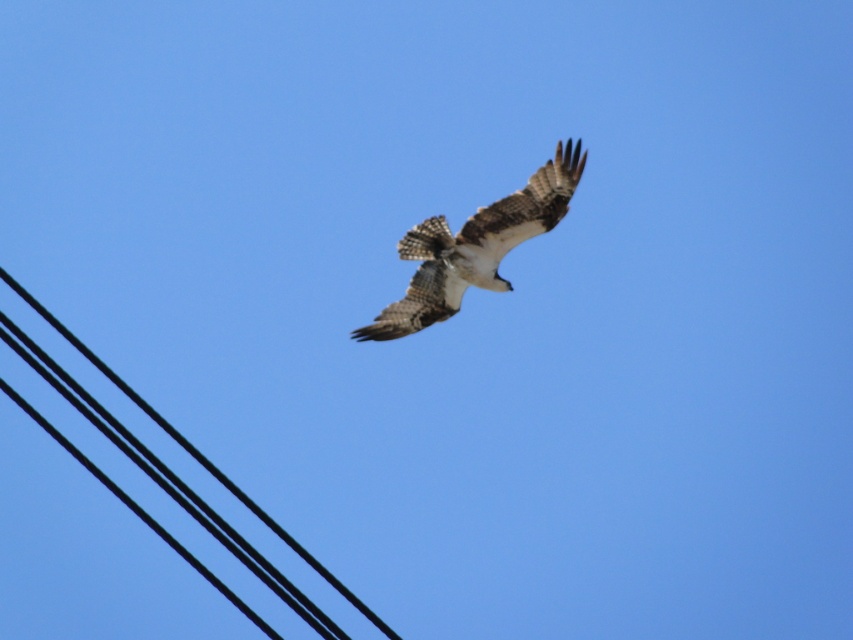
Question: Which point is farther to the camera?

Choices:
 (A) brown/white speckled eagle at center
 (B) black wire at upper left

Answer: (A)

Question: Is brown/white speckled eagle at center smaller than black wire at upper left?

Choices:
 (A) yes
 (B) no

Answer: (A)

Question: Which point appears closest to the camera in this image?

Choices:
 (A) (386, 316)
 (B) (44, 314)

Answer: (B)

Question: Is brown/white speckled eagle at center below black wire at upper left?

Choices:
 (A) yes
 (B) no

Answer: (B)

Question: Can you confirm if brown/white speckled eagle at center is smaller than black wire at upper left?

Choices:
 (A) yes
 (B) no

Answer: (A)